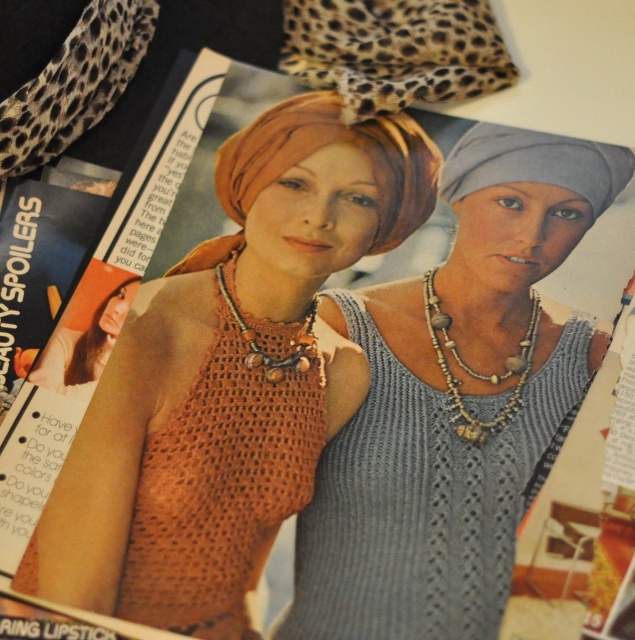
What is the 2D coordinate of the knitted orange tank top at center?

The knitted orange tank top at center is located at the 2D coordinate point of (455, 401).

You are a fashion designer reviewing a magazine layout. You need to place a new accessory between the knitted orange tank top at center and the orange knit tank top at lower left. Based on their positions, which tank top should the accessory be closer to?

The knitted orange tank top at center is to the right of the orange knit tank top at lower left. Therefore, the accessory should be placed closer to the knitted orange tank top at center to maintain symmetry between the two items.